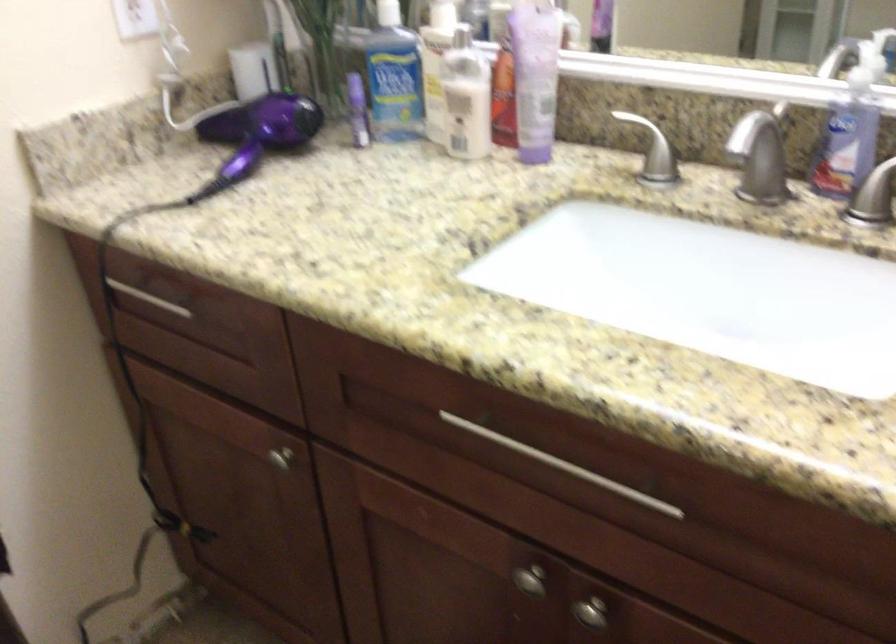
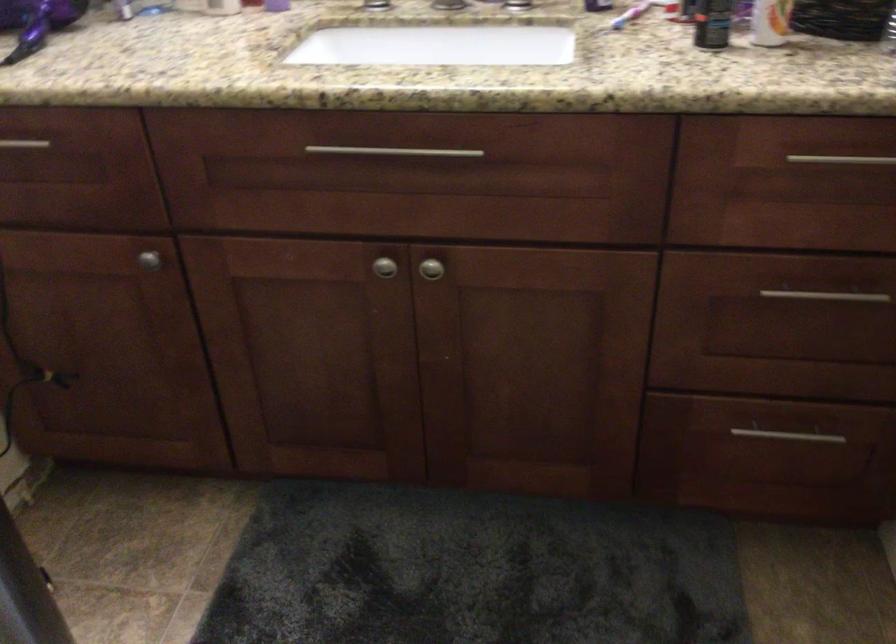
Where in the second image is the point corresponding to [246,147] from the first image?

(37, 22)